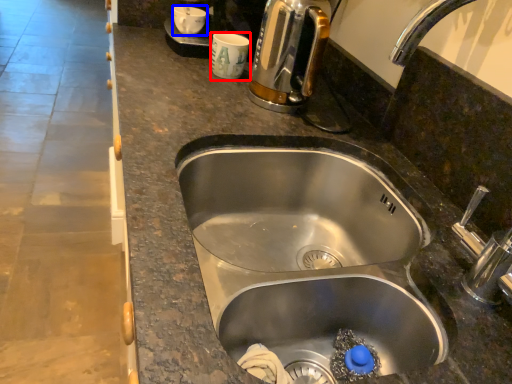
Question: Among these objects, which one is farthest to the camera, coffee cup (highlighted by a red box) or coffee cup (highlighted by a blue box)?

Choices:
 (A) coffee cup
 (B) coffee cup

Answer: (B)